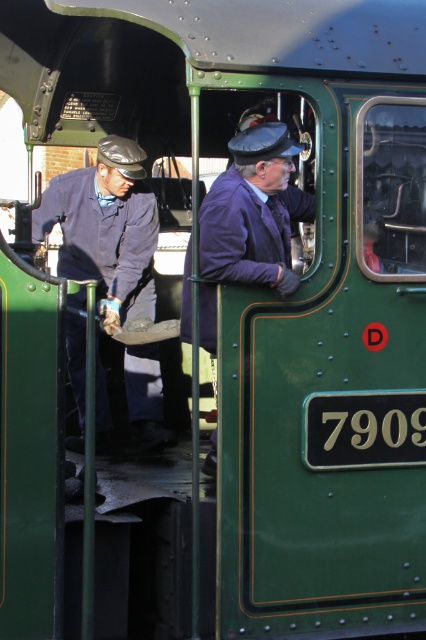
This screenshot has height=640, width=426. Identify the location of blue fabric uniform at center. (106, 227).

Does blue fabric uniform at center have a lesser height compared to purple woolen jacket at center?

In fact, blue fabric uniform at center may be taller than purple woolen jacket at center.

Locate an element on the screen. blue fabric uniform at center is located at coordinates (106, 227).